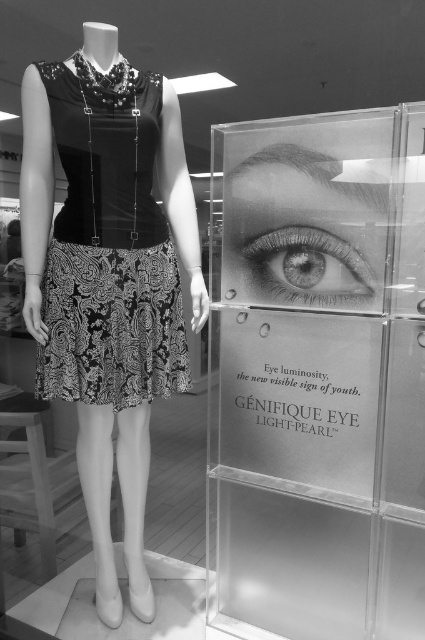
You are a store employee who needs to place a new poster on the wall behind the transparent acrylic at right and the black satin dress at center. Which object should you place the poster closer to if you want the poster to be seen more prominently by customers entering the store?

The transparent acrylic at right is bigger than the black satin dress at center, so placing the poster closer to the transparent acrylic at right would make it more prominent as it has a larger surface area to draw attention.

You are a customer standing in front of the display case. Where is the transparent acrylic at right located in the image?

The transparent acrylic at right is located at point 2D coordinates of [317,376].